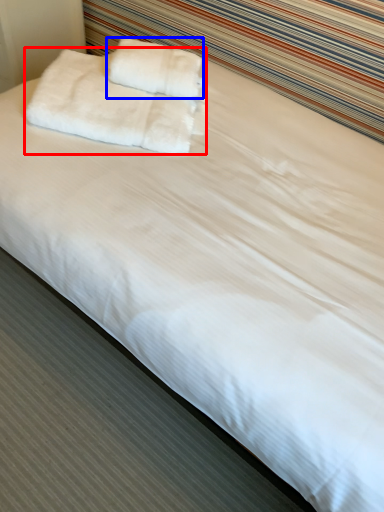
Question: Which of the following is the closest to the observer, towel (highlighted by a red box) or towel (highlighted by a blue box)?

Choices:
 (A) towel
 (B) towel

Answer: (A)